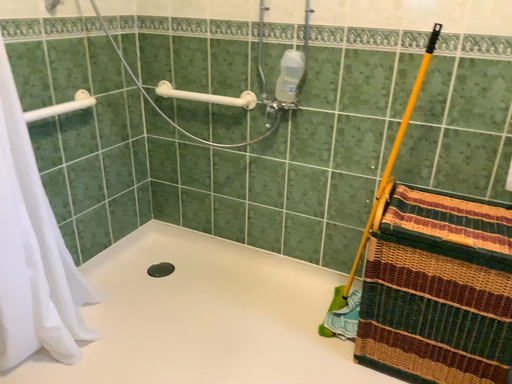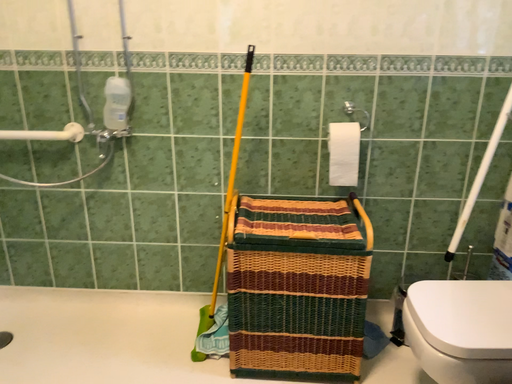
Question: How did the camera likely rotate when shooting the video?

Choices:
 (A) rotated right
 (B) rotated left

Answer: (A)